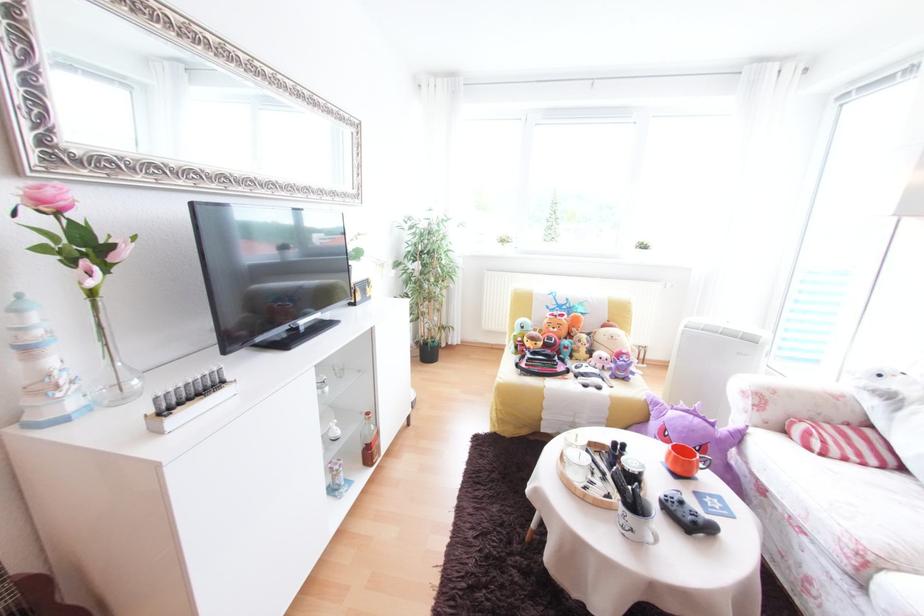
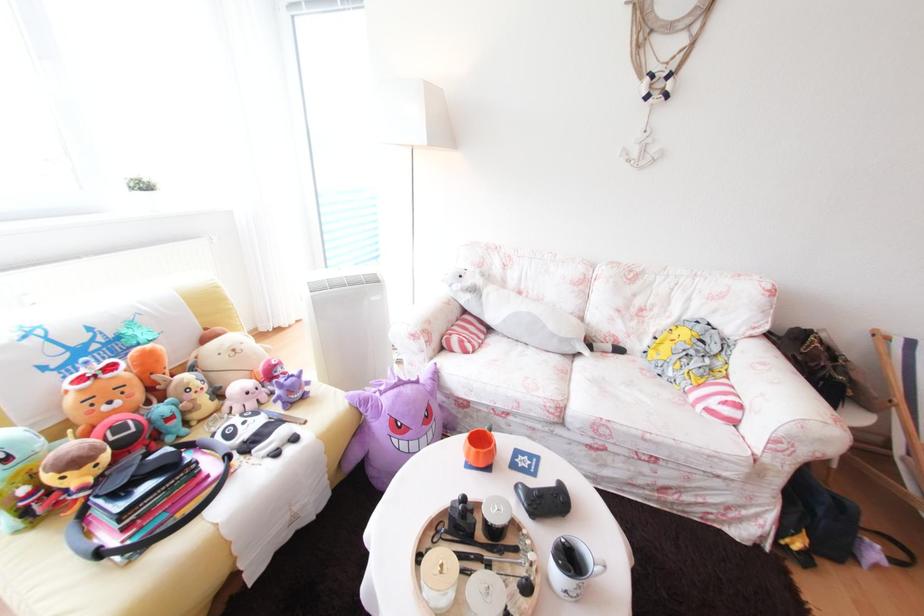
The images are taken continuously from a first-person perspective. In which direction is your viewpoint rotating?

The camera's rotation is toward right-down.